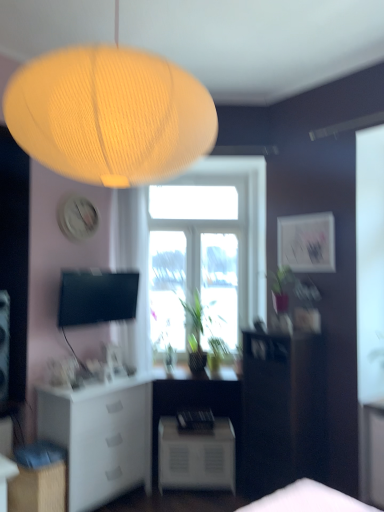
Question: Does transparent glass window at center lie behind matte white picture frame at upper right?

Choices:
 (A) yes
 (B) no

Answer: (A)

Question: From the image's perspective, is transparent glass window at center located above matte white picture frame at upper right?

Choices:
 (A) yes
 (B) no

Answer: (B)

Question: Is transparent glass window at center facing away from matte white picture frame at upper right?

Choices:
 (A) no
 (B) yes

Answer: (A)

Question: From a real-world perspective, is transparent glass window at center physically below matte white picture frame at upper right?

Choices:
 (A) yes
 (B) no

Answer: (A)

Question: Could you tell me if transparent glass window at center is facing matte white picture frame at upper right?

Choices:
 (A) yes
 (B) no

Answer: (B)

Question: From a real-world perspective, is transparent glass window at center located higher than matte white picture frame at upper right?

Choices:
 (A) no
 (B) yes

Answer: (A)

Question: Would you say white matte cabinet at lower left, which is the first cabinetry from back to front, is part of white matte nightstand at lower center's contents?

Choices:
 (A) yes
 (B) no

Answer: (B)

Question: Are white matte nightstand at lower center and white matte cabinet at lower left, the 2th cabinetry from the front, beside each other?

Choices:
 (A) yes
 (B) no

Answer: (B)

Question: Is white matte nightstand at lower center not near white matte cabinet at lower left, which is the first cabinetry from back to front?

Choices:
 (A) yes
 (B) no

Answer: (B)

Question: From the image's perspective, is white matte nightstand at lower center below white matte cabinet at lower left, which is the first cabinetry from back to front?

Choices:
 (A) yes
 (B) no

Answer: (A)

Question: Does white matte nightstand at lower center turn towards white matte cabinet at lower left, which is the first cabinetry from back to front?

Choices:
 (A) no
 (B) yes

Answer: (A)

Question: Does white matte nightstand at lower center have a lesser width compared to white matte cabinet at lower left, which is the first cabinetry from back to front?

Choices:
 (A) yes
 (B) no

Answer: (A)

Question: Can you confirm if matte white picture frame at upper right is taller than dark wood cabinet at right?

Choices:
 (A) yes
 (B) no

Answer: (B)